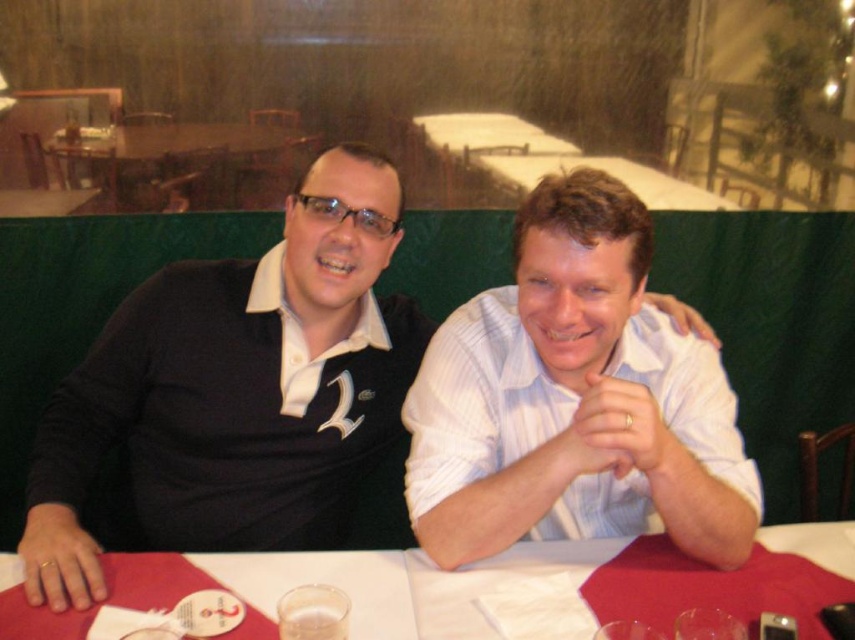
Question: Which point is closer to the camera?

Choices:
 (A) black matte shirt at center
 (B) white striped shirt at center
 (C) white matte hand at center
 (D) gold ring at lower left

Answer: (B)

Question: Can you confirm if white paper at center is positioned to the right of white paper at upper center?

Choices:
 (A) no
 (B) yes

Answer: (A)

Question: Is white striped shirt at center above gold ring at lower left?

Choices:
 (A) no
 (B) yes

Answer: (B)

Question: Which of the following is the farthest from the observer?

Choices:
 (A) (83, 579)
 (B) (382, 442)

Answer: (B)

Question: Can you confirm if black matte shirt at center is positioned to the right of white paper at upper center?

Choices:
 (A) no
 (B) yes

Answer: (A)

Question: Which point is farther to the camera?

Choices:
 (A) (585, 520)
 (B) (228, 134)
 (C) (18, 545)

Answer: (B)